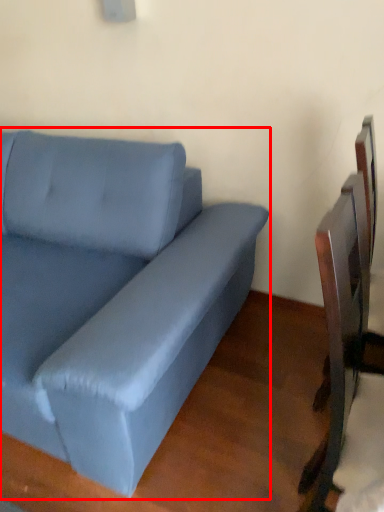
Question: From the image's perspective, considering the relative positions of studio couch (annotated by the red box) and swivel chair in the image provided, where is studio couch (annotated by the red box) located with respect to the staircase?

Choices:
 (A) below
 (B) above

Answer: (B)